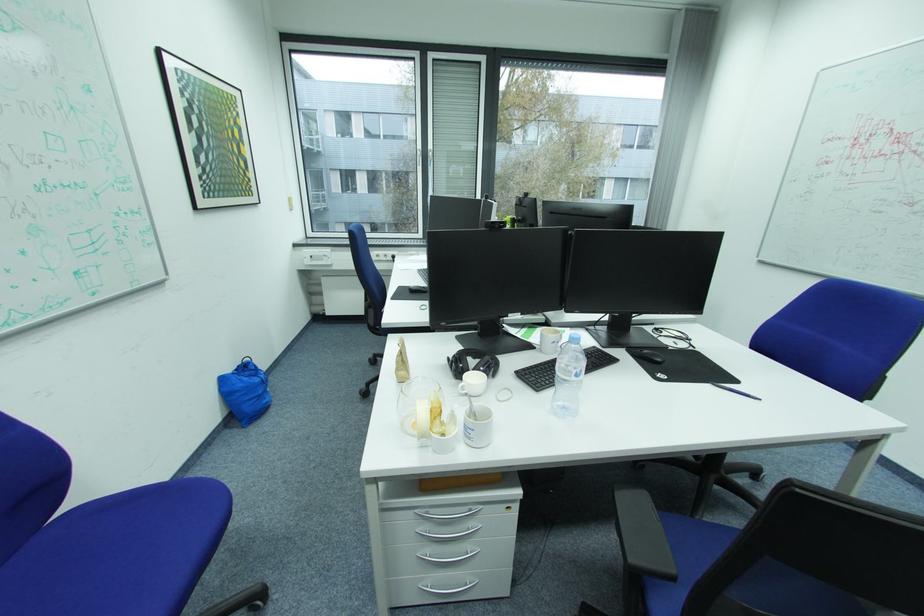
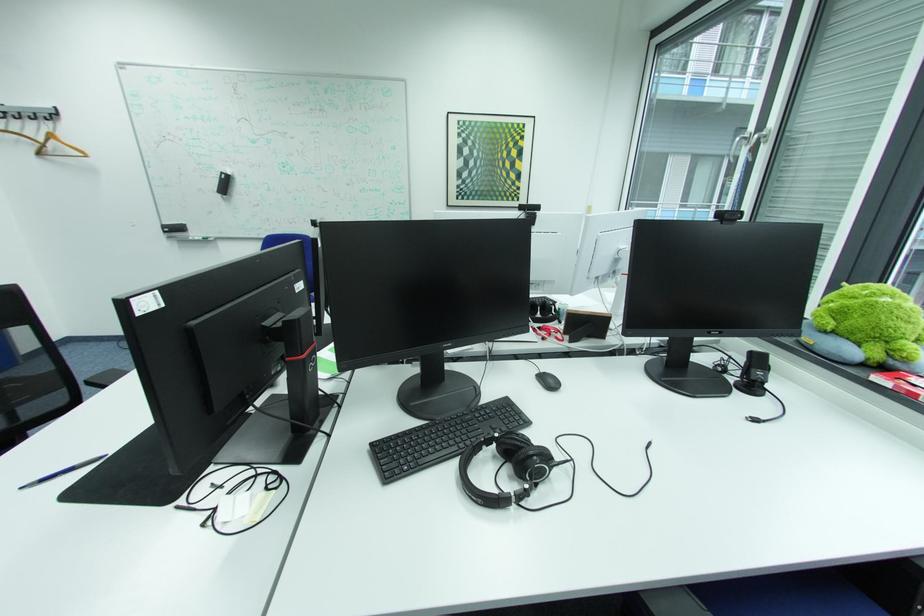
Find the pixel in the second image that matches the point at 703,347 in the first image.

(187, 508)